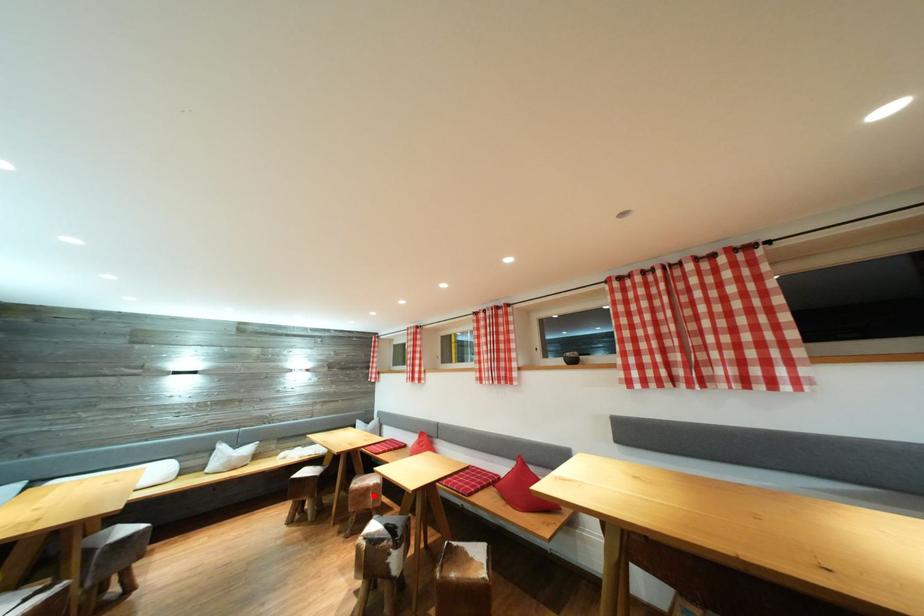
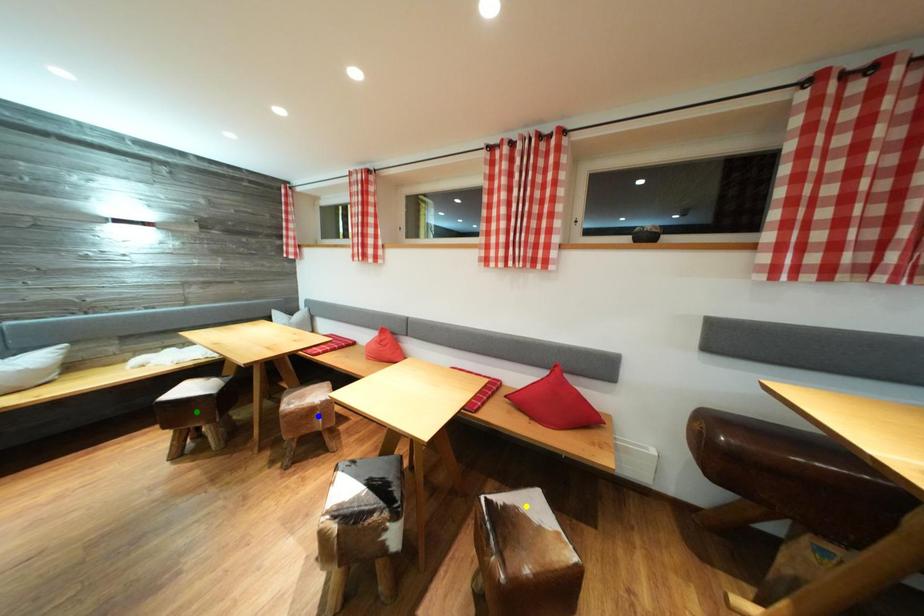
Question: I am providing you with two images of the same scene from different viewpoints. A red point is marked on the first image. You are given multiple points on the second image. Which point in image 2 is actually the same real-world point as the red point in image 1?

Choices:
 (A) yellow point
 (B) blue point
 (C) green point

Answer: (B)